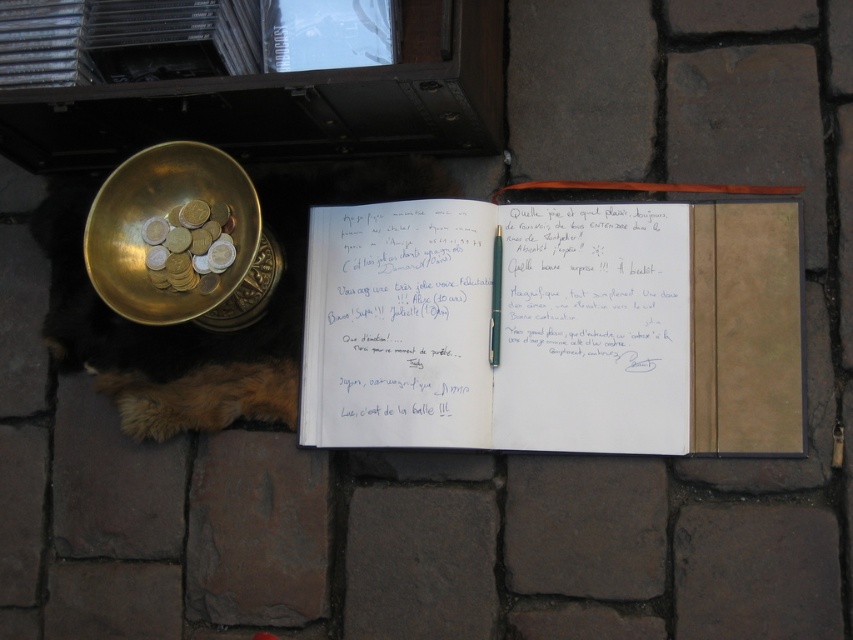
Question: Can you confirm if brown fur dog at lower left is positioned to the right of metallic silver pen at center?

Choices:
 (A) no
 (B) yes

Answer: (A)

Question: Can you confirm if white paper notebook at center is smaller than gold metallic coins at left?

Choices:
 (A) no
 (B) yes

Answer: (A)

Question: Does white paper notebook at center have a smaller size compared to gold metallic bowl at upper left?

Choices:
 (A) yes
 (B) no

Answer: (B)

Question: Estimate the real-world distances between objects in this image. Which object is closer to the gold metallic coins at left?

Choices:
 (A) gold metallic bowl at upper left
 (B) brown fur dog at lower left
 (C) metallic silver pen at center
 (D) white paper notebook at center

Answer: (A)

Question: Which is farther from the metallic silver pen at center?

Choices:
 (A) brown fur dog at lower left
 (B) gold metallic coins at left
 (C) white paper notebook at center
 (D) gold metallic bowl at upper left

Answer: (D)

Question: Which is nearer to the metallic silver pen at center?

Choices:
 (A) gold metallic bowl at upper left
 (B) brown fur dog at lower left

Answer: (B)